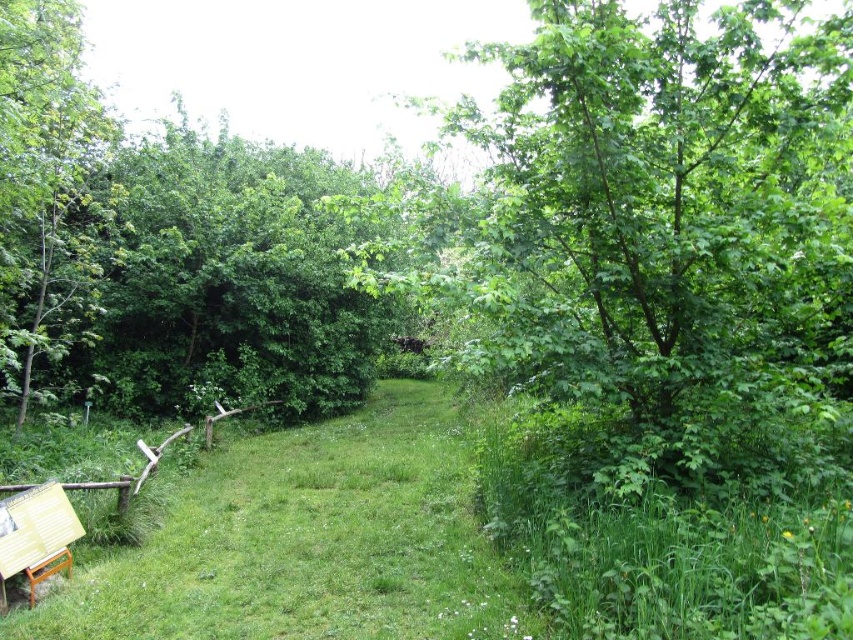
You are a hiker trying to navigate through the park. You see a green leafy tree at upper left and a wooden sign at lower left. Which object takes up more space in the image?

The wooden sign at lower left takes up more space in the image than the green leafy tree at upper left because the green leafy tree at upper left occupies less space than wooden sign at lower left.

You are standing at the point with coordinates 0.5, 0.5 in the image. You want to walk to the green grass at center. In which direction should you move?

The green grass at center is located at point (306, 541). Since your current position is at (426, 320), you should move northeast to reach it.